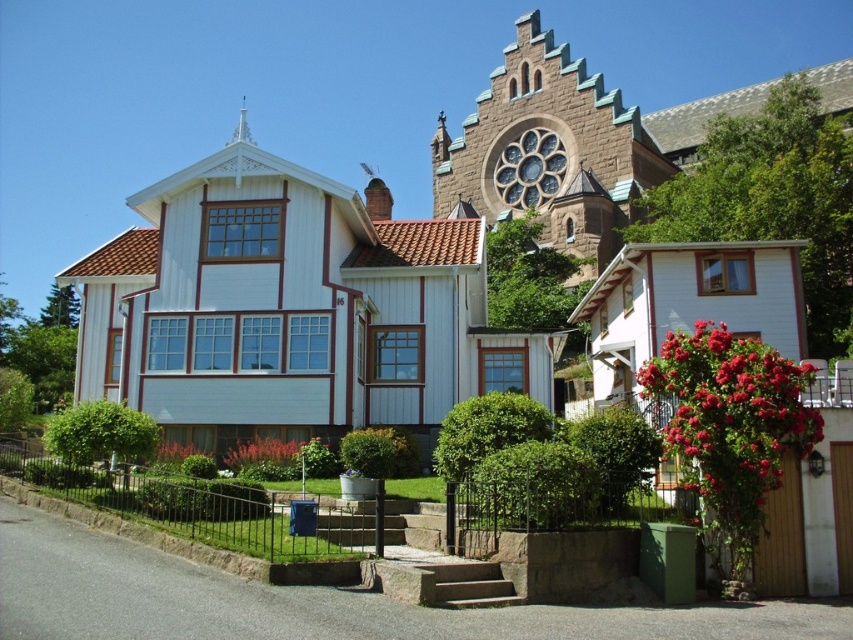
Can you confirm if white wood house at center is positioned above brown stone chapel at upper center?

Indeed, white wood house at center is positioned over brown stone chapel at upper center.

Does white wood house at center have a lesser height compared to brown stone chapel at upper center?

Incorrect, white wood house at center's height does not fall short of brown stone chapel at upper center's.

Where is `white wood house at center`? The width and height of the screenshot is (853, 640). white wood house at center is located at coordinates (291, 308).